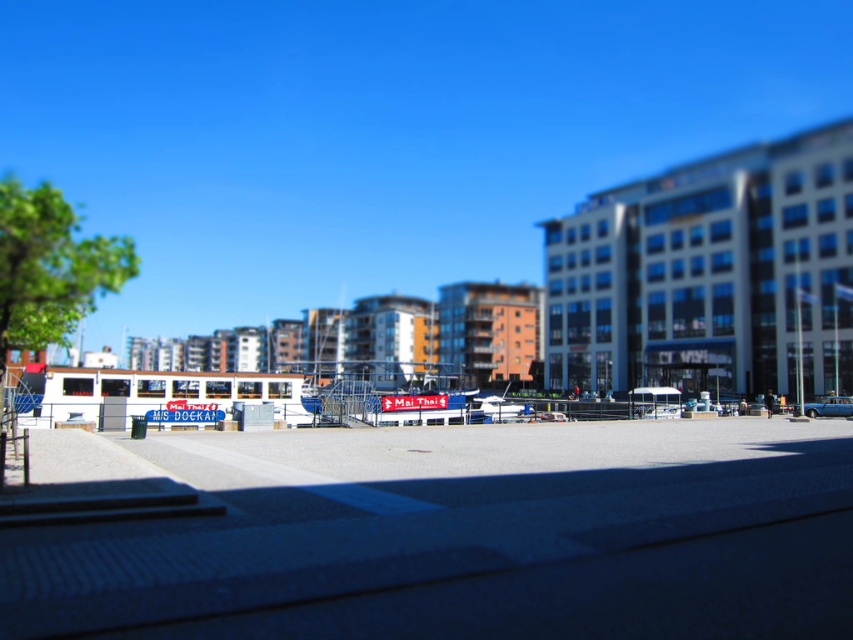
Looking at this image, which is more to the left, blue metallic car at center-right or blue metallic car at center?

blue metallic car at center

Which is more to the right, blue metallic car at center-right or blue metallic car at center?

Positioned to the right is blue metallic car at center-right.

Find the location of `blue metallic car at center-right`. blue metallic car at center-right is located at coordinates (828, 406).

At what (x,y) coordinates should I click in order to perform the action: click on blue metallic car at center-right. Please return your answer as a coordinate pair (x, y). Image resolution: width=853 pixels, height=640 pixels. Looking at the image, I should click on (828, 406).

From the picture: Which is below, silver metallic car at center or blue metallic car at center?

blue metallic car at center

Who is higher up, silver metallic car at center or blue metallic car at center?

silver metallic car at center is higher up.

Is point (671, 406) in front of point (698, 404)?

Yes, it is.

Image resolution: width=853 pixels, height=640 pixels. I want to click on silver metallic car at center, so click(662, 412).

Which is above, blue metallic car at center-right or silver metallic car at center?

silver metallic car at center is above.

Find the location of a particular element. blue metallic car at center-right is located at coordinates (828, 406).

Who is more distant from viewer, (845, 412) or (648, 410)?

The point (845, 412) is more distant.

The image size is (853, 640). I want to click on blue metallic car at center-right, so click(x=828, y=406).